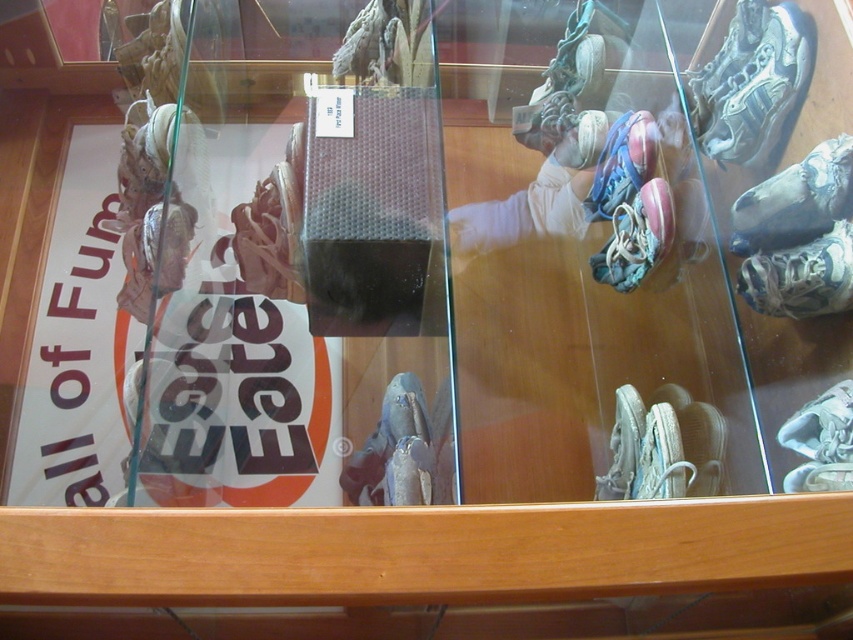
Can you confirm if white paper at left is smaller than white matte sneaker at lower center?

Incorrect, white paper at left is not smaller in size than white matte sneaker at lower center.

Is white paper at left to the left of white matte sneaker at lower center from the viewer's perspective?

Indeed, white paper at left is positioned on the left side of white matte sneaker at lower center.

This screenshot has width=853, height=640. Find the location of `white paper at left`. white paper at left is located at coordinates (239, 362).

At what (x,y) coordinates should I click in order to perform the action: click on white paper at left. Please return your answer as a coordinate pair (x, y). This screenshot has height=640, width=853. Looking at the image, I should click on (239, 362).

From the picture: Measure the distance between point (x=781, y=316) and camera.

Point (x=781, y=316) is 38.38 inches away from camera.

Who is positioned more to the right, white fabric sneaker at right or white leather shoe at center?

Positioned to the right is white fabric sneaker at right.

Who is more distant from viewer, (846, 304) or (611, 211)?

The point (611, 211) is more distant.

At what (x,y) coordinates should I click in order to perform the action: click on white fabric sneaker at right. Please return your answer as a coordinate pair (x, y). The height and width of the screenshot is (640, 853). Looking at the image, I should click on (801, 276).

Is point (640, 237) more distant than point (641, 150)?

No, it is in front of (641, 150).

What do you see at coordinates (636, 237) in the screenshot? Image resolution: width=853 pixels, height=640 pixels. I see `white leather shoe at center` at bounding box center [636, 237].

You are a GUI agent. You are given a task and a screenshot of the screen. Output one action in this format:
    pyautogui.click(x=<x>, y=<y>)
    Task: Click on the white leather shoe at center
    
    Given the screenshot: What is the action you would take?
    pyautogui.click(x=636, y=237)